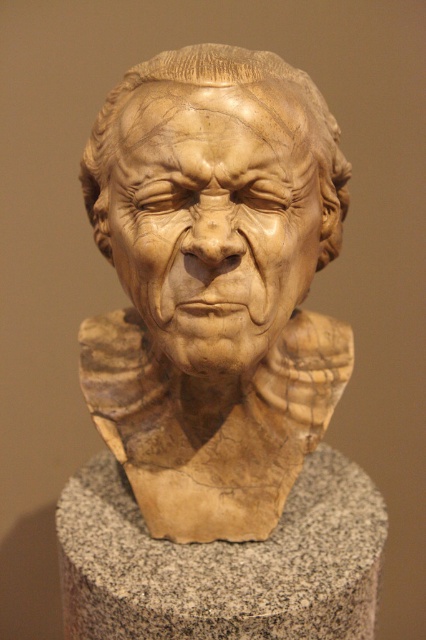
Is the position of marble bust at center more distant than that of light brown wood carving at center?

That is True.

Can you confirm if marble bust at center is positioned above light brown wood carving at center?

Incorrect, marble bust at center is not positioned above light brown wood carving at center.

Between point (284, 108) and point (235, 170), which one is positioned in front?

Point (235, 170) is more forward.

You are a GUI agent. You are given a task and a screenshot of the screen. Output one action in this format:
    pyautogui.click(x=<x>, y=<y>)
    Task: Click on the marble bust at center
    The image size is (426, 640).
    Given the screenshot: What is the action you would take?
    pyautogui.click(x=213, y=285)

Is light brown wood carving at center below granite pedestal at center?

No, light brown wood carving at center is not below granite pedestal at center.

Does light brown wood carving at center lie in front of granite pedestal at center?

Yes, it is in front of granite pedestal at center.

Which is behind, point (161, 170) or point (307, 618)?

The point (307, 618) is more distant.

Find the location of `light brown wood carving at center`. light brown wood carving at center is located at coordinates (213, 220).

Can you confirm if marble bust at center is positioned below granite pedestal at center?

Incorrect, marble bust at center is not positioned below granite pedestal at center.

Between marble bust at center and granite pedestal at center, which one has less height?

With less height is granite pedestal at center.

Between point (238, 218) and point (157, 602), which one is positioned in front?

Point (238, 218) is more forward.

The width and height of the screenshot is (426, 640). Find the location of `marble bust at center`. marble bust at center is located at coordinates (213, 285).